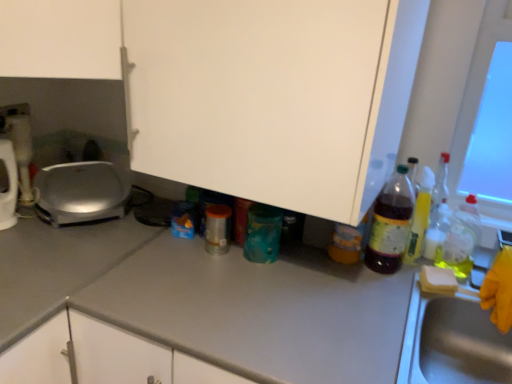
I want to click on vacant area that is in front of translucent plastic bottle at right, which is the 3th bottle from left to right, so click(378, 295).